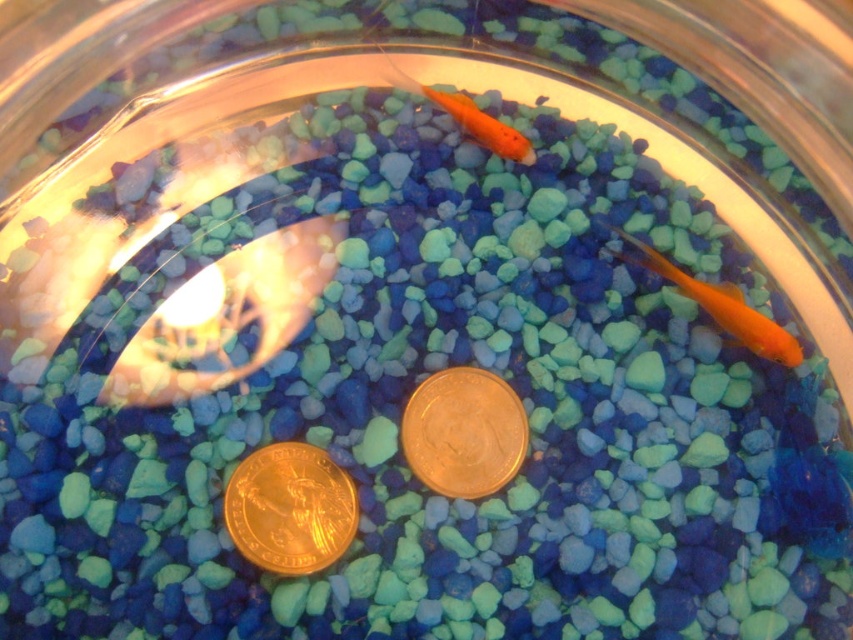
You are an aquatic robot designed to retrieve coins from the aquarium. You see two coins at the bottom of the tank. Which coin is located to the left of the other? The gold plated coin at center and the gold metallic coin at center are both in your view. Please specify which one is on the left.

The gold plated coin at center is positioned on the left side of the gold metallic coin at center, so the gold plated coin at center is on the left.

You are a goldfish in the aquarium. You see two coins at point (511,458). If you want to reach the nearest coin first, which coordinate should you swim towards?

Both coins are located at the same coordinate point (511,458), so you can swim towards either one as they are in the same location.